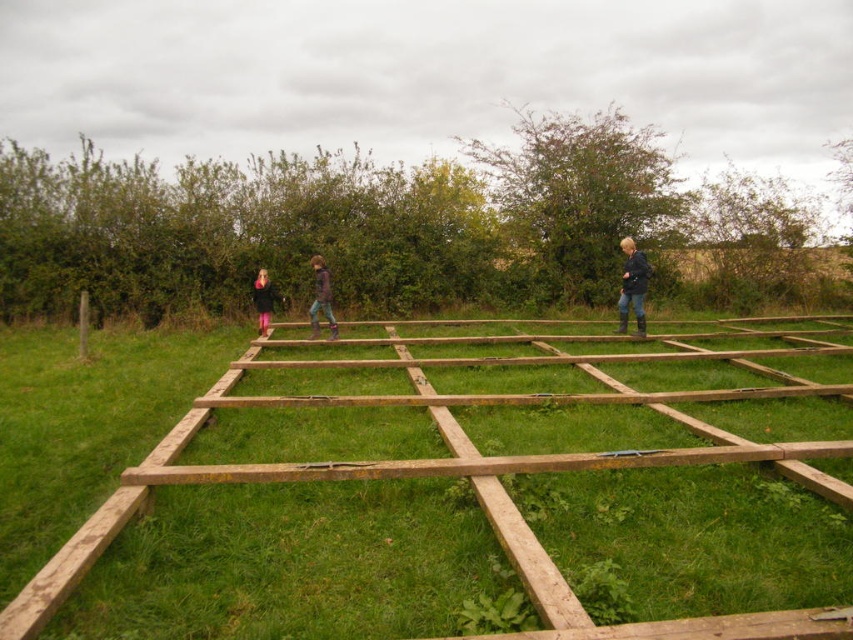
You are standing at the edge of the field and see both the dark blue jacket at center and the pink fabric pants at center. Which object is closer to you?

The dark blue jacket at center is closer to you because it is in front of the pink fabric pants at center.

You are an observer standing in the middle of the field looking at the wooden framework. You notice two items at the center of the scene, the dark blue jacket at center and the pink fabric pants at center. Which item takes up more space in the scene?

The dark blue jacket at center is larger in size than the pink fabric pants at center, so it takes up more space in the scene.